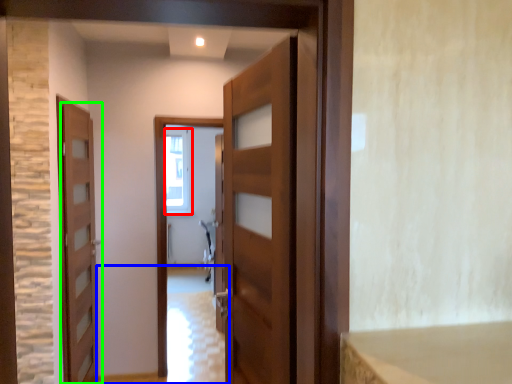
Question: Estimate the real-world distances between objects in this image. Which object is farther from window (highlighted by a red box), path (highlighted by a blue box) or door (highlighted by a green box)?

Choices:
 (A) path
 (B) door

Answer: (B)